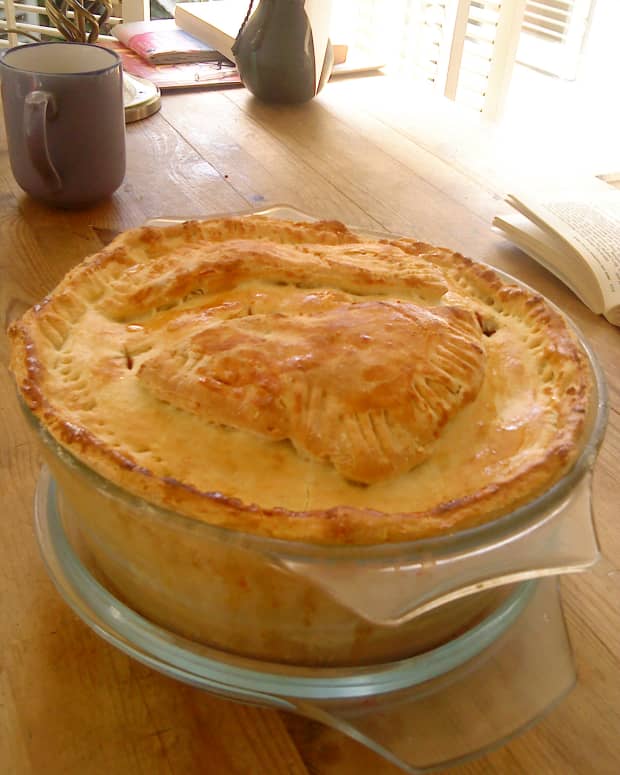
This screenshot has width=620, height=775. Identify the location of casserole top. (390, 456).